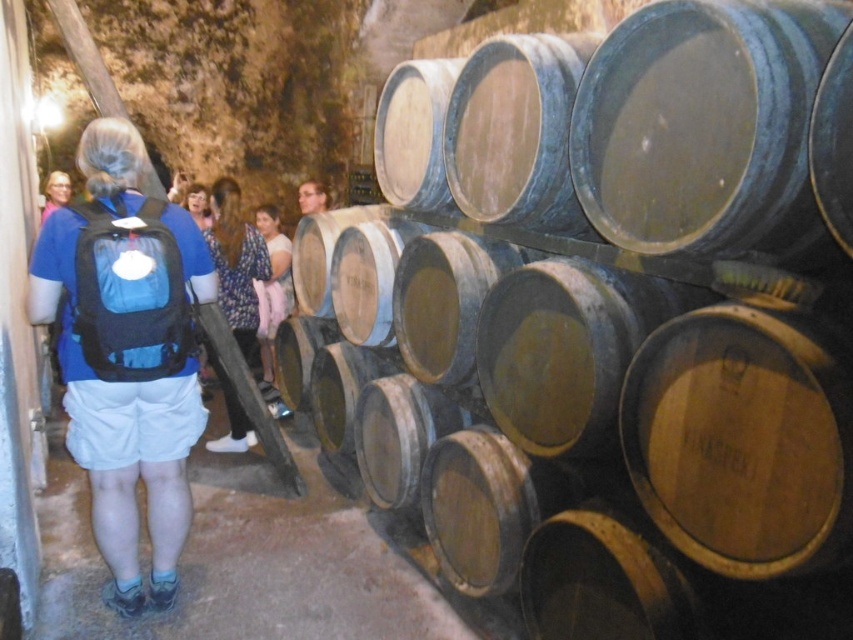
You are standing in a wine cellar and see a blue fabric backpack at left and a matte blue backpack at center. Which backpack is nearer to you?

The blue fabric backpack at left is closer to the viewer than the matte blue backpack at center.